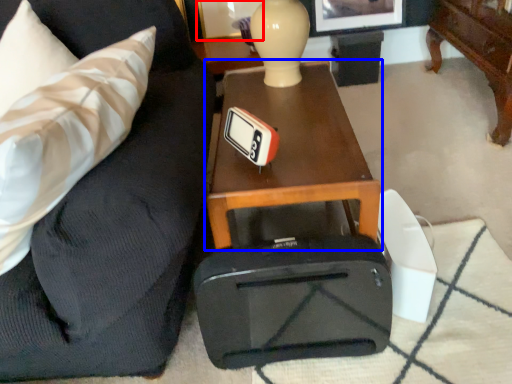
Question: Which point is further to the camera, picture frame (highlighted by a red box) or table (highlighted by a blue box)?

Choices:
 (A) picture frame
 (B) table

Answer: (A)